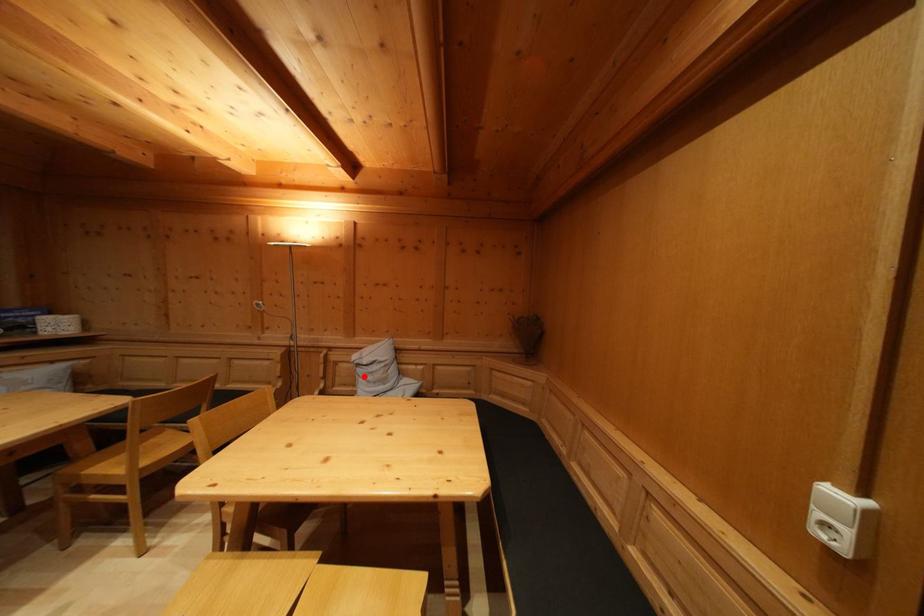
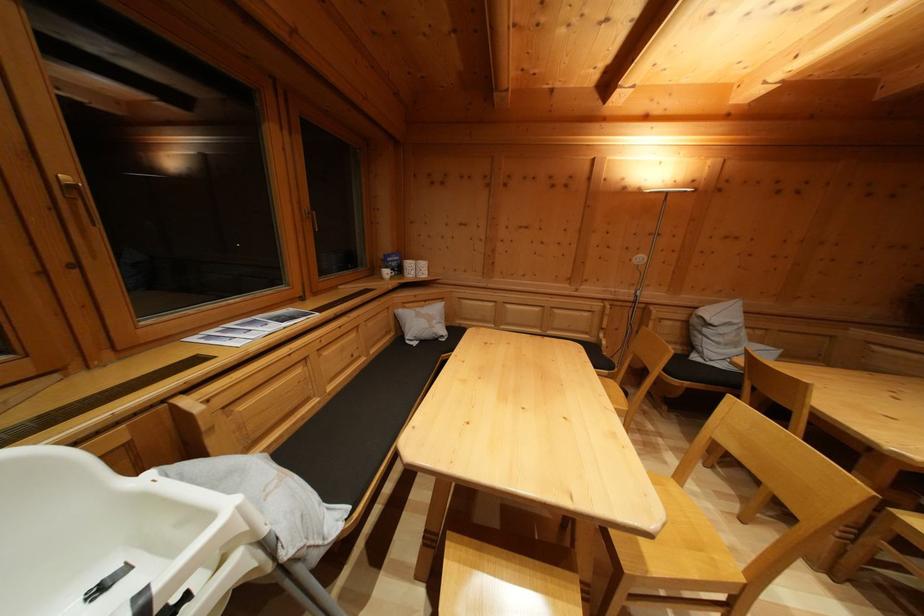
Where in the second image is the point corresponding to the highlighted location from the first image?

(711, 337)